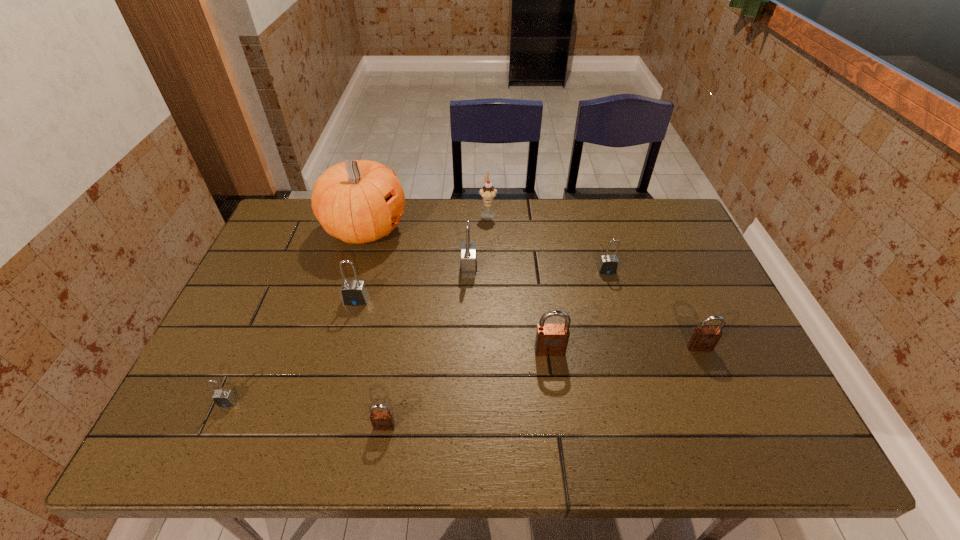
In order to click on padlock object that ranks as the third closest to the pumpkin in this screenshot , I will do `click(223, 398)`.

Locate an element on the screen. Image resolution: width=960 pixels, height=540 pixels. the third closest gray padlock relative to the rightmost gray padlock is located at coordinates (223, 398).

Choose which gray padlock is the nearest neighbor to the second smallest gray padlock. Please provide its 2D coordinates. Your answer should be formatted as a tuple, i.e. [(x, y)], where the tuple contains the x and y coordinates of a point satisfying the conditions above.

[(468, 265)]

Locate which brown padlock is the second closest to the fourth object from left to right. Please provide its 2D coordinates. Your answer should be formatted as a tuple, i.e. [(x, y)], where the tuple contains the x and y coordinates of a point satisfying the conditions above.

[(703, 338)]

Locate which brown padlock is the closest to the rightmost brown padlock. Please provide its 2D coordinates. Your answer should be formatted as a tuple, i.e. [(x, y)], where the tuple contains the x and y coordinates of a point satisfying the conditions above.

[(551, 339)]

The image size is (960, 540). I want to click on vacant space that satisfies the following two spatial constraints: 1. on the front side of the icecream; 2. on the shackle of the tallest padlock, so click(x=489, y=268).

I want to click on vacant area in the image that satisfies the following two spatial constraints: 1. on the shackle of the biggest gray padlock; 2. on the shackle of the second nearest padlock, so click(466, 402).